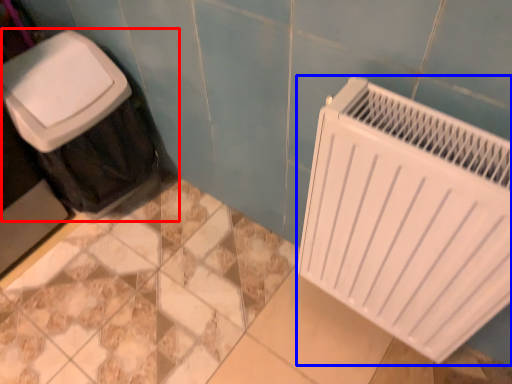
Question: Which point is closer to the camera, waste container (highlighted by a red box) or radiator (highlighted by a blue box)?

Choices:
 (A) waste container
 (B) radiator

Answer: (B)